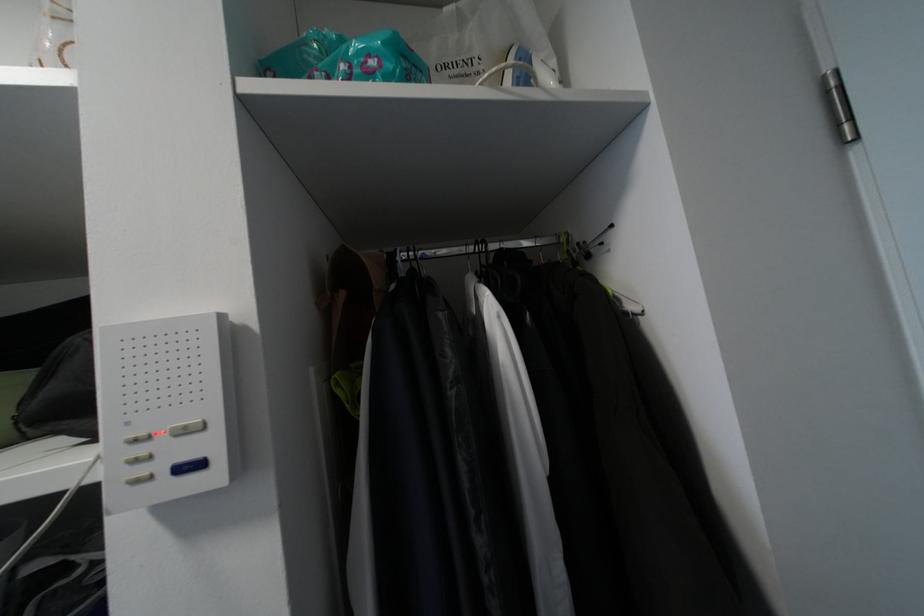
The width and height of the screenshot is (924, 616). In order to click on white bag handle in this screenshot , I will do `click(457, 15)`.